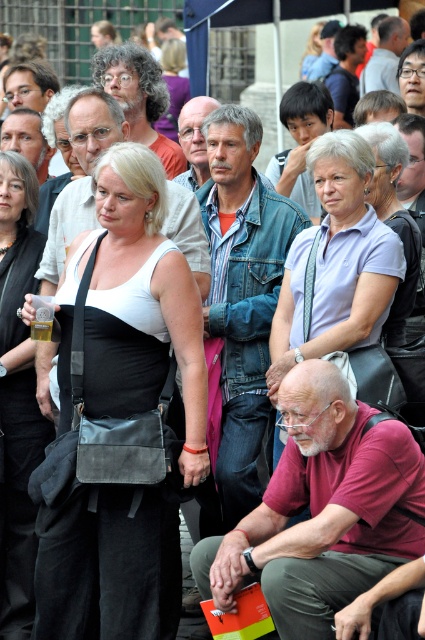
You are a photographer trying to capture a clear shot of the light purple fabric shirt at upper center and the black leather bag at center. Which object should you focus on first to ensure both are in focus?

The light purple fabric shirt at upper center is closer to you, so focus on it first to ensure both objects are in focus.

You are at an outdoor event and see the matte black bag at center. If you need to reach it within 5 seconds, considering an average walking speed of 3 feet per second, can you make it in time?

The matte black bag at center is 101.01 feet away from viewer. At 3 feet per second, it would take approximately 33.67 seconds to reach it, so no, you cannot make it in time within 5 seconds.